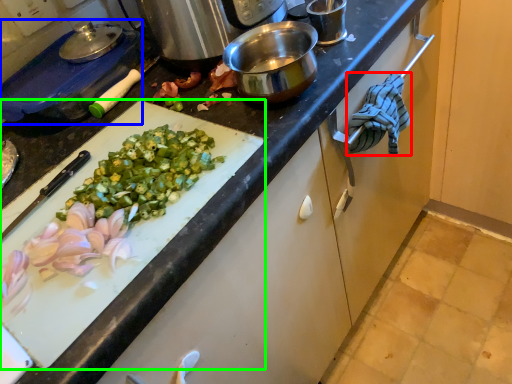
Question: Which is nearer to the cloth (highlighted by a red box)? kitchen appliance (highlighted by a blue box) or cutting board (highlighted by a green box).

Choices:
 (A) kitchen appliance
 (B) cutting board

Answer: (B)